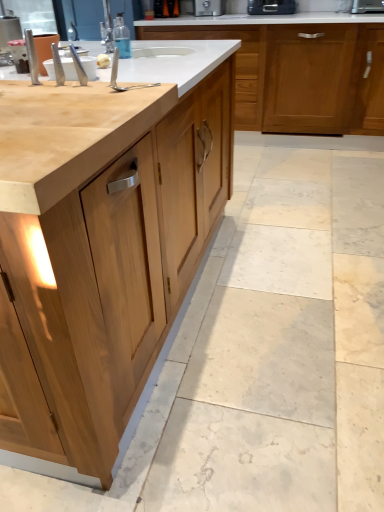
Locate an element on the screen. The image size is (384, 512). natural wood cabinet at center, which is the 1th cabinetry in front-to-back order is located at coordinates (119, 255).

Measure the distance between point (254, 18) and camera.

Point (254, 18) and camera are 2.88 meters apart.

Based on the photo, measure the distance between point (x=366, y=8) and camera.

Point (x=366, y=8) and camera are 9.47 feet apart.

Locate an element on the screen. natural wood cabinet at center, which is counted as the 2th cabinetry, starting from the back is located at coordinates (119, 255).

Could you measure the distance between matte wood cabinet at center, the 2th cabinetry in the front-to-back sequence, and natural wood cabinet at center, which is the 1th cabinetry in front-to-back order?

matte wood cabinet at center, the 2th cabinetry in the front-to-back sequence, and natural wood cabinet at center, which is the 1th cabinetry in front-to-back order, are 5.96 feet apart.

Considering the points (274, 122) and (1, 212), which point is behind, point (274, 122) or point (1, 212)?

Positioned behind is point (274, 122).

Based on the photo, between matte wood cabinet at center, the 2th cabinetry in the front-to-back sequence, and natural wood cabinet at center, which is the 1th cabinetry in front-to-back order, which one appears on the right side from the viewer's perspective?

matte wood cabinet at center, the 2th cabinetry in the front-to-back sequence.

Is matte wood cabinet at center, the first cabinetry positioned from the back, directly adjacent to natural wood cabinet at center, which is the 1th cabinetry in front-to-back order?

matte wood cabinet at center, the first cabinetry positioned from the back, is not next to natural wood cabinet at center, which is the 1th cabinetry in front-to-back order, and they're not touching.

Considering the sizes of objects metallic silver toaster at upper right, which is the second appliance in left-to-right order, and transparent plastic bottle at upper center in the image provided, who is smaller, metallic silver toaster at upper right, which is the second appliance in left-to-right order, or transparent plastic bottle at upper center?

Smaller between the two is transparent plastic bottle at upper center.

The width and height of the screenshot is (384, 512). What are the coordinates of `appliance that is the 1st object located behind the transparent plastic bottle at upper center` in the screenshot? It's located at (367, 6).

Do you think metallic silver toaster at upper right, which is the second appliance in left-to-right order, is within transparent plastic bottle at upper center, or outside of it?

The correct answer is: outside.

Is metallic silver toaster at upper right, which is the second appliance in left-to-right order, far away from transparent plastic bottle at upper center?

That's right, there is a large distance between metallic silver toaster at upper right, which is the second appliance in left-to-right order, and transparent plastic bottle at upper center.

Considering the positions of objects metallic silver toaster at upper right, the 1th appliance in the right-to-left sequence, and natural wood cabinet at center, which is the 1th cabinetry in front-to-back order, in the image provided, who is more to the right, metallic silver toaster at upper right, the 1th appliance in the right-to-left sequence, or natural wood cabinet at center, which is the 1th cabinetry in front-to-back order,?

Positioned to the right is metallic silver toaster at upper right, the 1th appliance in the right-to-left sequence.

Locate an element on the screen. Image resolution: width=384 pixels, height=512 pixels. the 1st appliance above when counting from the natural wood cabinet at center, which is the 1th cabinetry in front-to-back order (from the image's perspective) is located at coordinates 367,6.

Considering the relative sizes of metallic silver toaster at upper right, which is the second appliance in left-to-right order, and natural wood cabinet at center, which is the 1th cabinetry in front-to-back order, in the image provided, is metallic silver toaster at upper right, which is the second appliance in left-to-right order, taller than natural wood cabinet at center, which is the 1th cabinetry in front-to-back order,?

No.

Is metallic silver toaster at upper right, the 1th appliance in the right-to-left sequence, facing away from natural wood cabinet at center, which is the 1th cabinetry in front-to-back order?

That's not correct — metallic silver toaster at upper right, the 1th appliance in the right-to-left sequence, is not looking away from natural wood cabinet at center, which is the 1th cabinetry in front-to-back order.

Is metallic silver toaster at upper right, which is the second appliance in left-to-right order, touching matte wood cabinet at center, the 2th cabinetry in the front-to-back sequence?

Result: metallic silver toaster at upper right, which is the second appliance in left-to-right order, is not next to matte wood cabinet at center, the 2th cabinetry in the front-to-back sequence, and they're not touching.

Is metallic silver toaster at upper right, which is the second appliance in left-to-right order, wider or thinner than matte wood cabinet at center, the first cabinetry positioned from the back?

Considering their sizes, metallic silver toaster at upper right, which is the second appliance in left-to-right order, looks slimmer than matte wood cabinet at center, the first cabinetry positioned from the back.

Is metallic silver toaster at upper right, which is the second appliance in left-to-right order, bigger than matte wood cabinet at center, the first cabinetry positioned from the back?

Actually, metallic silver toaster at upper right, which is the second appliance in left-to-right order, might be smaller than matte wood cabinet at center, the first cabinetry positioned from the back.

Which object is further away from the camera taking this photo, metallic silver toaster at upper right, which is the second appliance in left-to-right order, or matte wood cabinet at center, the 2th cabinetry in the front-to-back sequence?

metallic silver toaster at upper right, which is the second appliance in left-to-right order, is behind.

Does black plastic toaster at upper center, which ranks as the 1th appliance in left-to-right order, come in front of matte wood cabinet at center, the 2th cabinetry in the front-to-back sequence?

No, black plastic toaster at upper center, which ranks as the 1th appliance in left-to-right order, is further to the viewer.

Is point (249, 14) positioned after point (329, 110)?

No, it is in front of (329, 110).

Considering the relative sizes of black plastic toaster at upper center, marked as the 2th appliance in a right-to-left arrangement, and matte wood cabinet at center, the first cabinetry positioned from the back, in the image provided, is black plastic toaster at upper center, marked as the 2th appliance in a right-to-left arrangement, thinner than matte wood cabinet at center, the first cabinetry positioned from the back,?

Correct, the width of black plastic toaster at upper center, marked as the 2th appliance in a right-to-left arrangement, is less than that of matte wood cabinet at center, the first cabinetry positioned from the back.

Who is smaller, black plastic toaster at upper center, marked as the 2th appliance in a right-to-left arrangement, or matte wood cabinet at center, the 2th cabinetry in the front-to-back sequence?

With smaller size is black plastic toaster at upper center, marked as the 2th appliance in a right-to-left arrangement.

Can you confirm if matte wood cabinet at center, the first cabinetry positioned from the back, is positioned to the right of black plastic toaster at upper center, marked as the 2th appliance in a right-to-left arrangement?

Correct, you'll find matte wood cabinet at center, the first cabinetry positioned from the back, to the right of black plastic toaster at upper center, marked as the 2th appliance in a right-to-left arrangement.

Is matte wood cabinet at center, the 2th cabinetry in the front-to-back sequence, situated inside black plastic toaster at upper center, which ranks as the 1th appliance in left-to-right order, or outside?

matte wood cabinet at center, the 2th cabinetry in the front-to-back sequence, is located beyond the bounds of black plastic toaster at upper center, which ranks as the 1th appliance in left-to-right order.

Is matte wood cabinet at center, the first cabinetry positioned from the back, wider than black plastic toaster at upper center, which ranks as the 1th appliance in left-to-right order?

Correct, the width of matte wood cabinet at center, the first cabinetry positioned from the back, exceeds that of black plastic toaster at upper center, which ranks as the 1th appliance in left-to-right order.

Considering the positions of objects matte wood cabinet at center, the 2th cabinetry in the front-to-back sequence, and black plastic toaster at upper center, which ranks as the 1th appliance in left-to-right order, in the image provided, who is behind, matte wood cabinet at center, the 2th cabinetry in the front-to-back sequence, or black plastic toaster at upper center, which ranks as the 1th appliance in left-to-right order,?

black plastic toaster at upper center, which ranks as the 1th appliance in left-to-right order, is more distant.

From the image's perspective, would you say black plastic toaster at upper center, which ranks as the 1th appliance in left-to-right order, is positioned over natural wood cabinet at center, which is counted as the 2th cabinetry, starting from the back?

Yes, from the image's perspective, black plastic toaster at upper center, which ranks as the 1th appliance in left-to-right order, is on top of natural wood cabinet at center, which is counted as the 2th cabinetry, starting from the back.

In the image, is black plastic toaster at upper center, which ranks as the 1th appliance in left-to-right order, positioned in front of or behind natural wood cabinet at center, which is counted as the 2th cabinetry, starting from the back?

Clearly, black plastic toaster at upper center, which ranks as the 1th appliance in left-to-right order, is behind natural wood cabinet at center, which is counted as the 2th cabinetry, starting from the back.

From a real-world perspective, relative to natural wood cabinet at center, which is the 1th cabinetry in front-to-back order, is black plastic toaster at upper center, marked as the 2th appliance in a right-to-left arrangement, vertically above or below?

From a real-world perspective, black plastic toaster at upper center, marked as the 2th appliance in a right-to-left arrangement, is physically above natural wood cabinet at center, which is the 1th cabinetry in front-to-back order.

What's the angular difference between black plastic toaster at upper center, which ranks as the 1th appliance in left-to-right order, and natural wood cabinet at center, which is the 1th cabinetry in front-to-back order,'s facing directions?

The angular difference between black plastic toaster at upper center, which ranks as the 1th appliance in left-to-right order, and natural wood cabinet at center, which is the 1th cabinetry in front-to-back order, is 87.2 degrees.

Locate an element on the screen. The height and width of the screenshot is (512, 384). cabinetry below the natural wood cabinet at center, which is the 1th cabinetry in front-to-back order (from a real-world perspective) is located at coordinates (296, 69).

At what (x,y) coordinates should I click in order to perform the action: click on bottle located in front of the metallic silver toaster at upper right, the 1th appliance in the right-to-left sequence. Please return your answer as a coordinate pair (x, y). The width and height of the screenshot is (384, 512). Looking at the image, I should click on (122, 37).

Based on their spatial positions, is natural wood cabinet at center, which is counted as the 2th cabinetry, starting from the back, or transparent plastic bottle at upper center further from metallic silver toaster at upper right, which is the second appliance in left-to-right order?

natural wood cabinet at center, which is counted as the 2th cabinetry, starting from the back, is further to metallic silver toaster at upper right, which is the second appliance in left-to-right order.

Which object lies nearer to the anchor point transparent plastic bottle at upper center, natural wood cabinet at center, which is counted as the 2th cabinetry, starting from the back, or metallic silver toaster at upper right, which is the second appliance in left-to-right order?

natural wood cabinet at center, which is counted as the 2th cabinetry, starting from the back, is positioned closer to the anchor transparent plastic bottle at upper center.

From the image, which object appears to be nearer to matte wood cabinet at center, the first cabinetry positioned from the back, transparent plastic bottle at upper center or natural wood cabinet at center, which is counted as the 2th cabinetry, starting from the back?

transparent plastic bottle at upper center is positioned closer to the anchor matte wood cabinet at center, the first cabinetry positioned from the back.

Which object lies nearer to the anchor point matte wood cabinet at center, the 2th cabinetry in the front-to-back sequence, metallic silver toaster at upper right, which is the second appliance in left-to-right order, or black plastic toaster at upper center, marked as the 2th appliance in a right-to-left arrangement?

The object closer to matte wood cabinet at center, the 2th cabinetry in the front-to-back sequence, is black plastic toaster at upper center, marked as the 2th appliance in a right-to-left arrangement.

Based on their spatial positions, is black plastic toaster at upper center, which ranks as the 1th appliance in left-to-right order, or metallic silver toaster at upper right, the 1th appliance in the right-to-left sequence, closer to transparent plastic bottle at upper center?

black plastic toaster at upper center, which ranks as the 1th appliance in left-to-right order, is closer to transparent plastic bottle at upper center.

Based on their spatial positions, is metallic silver toaster at upper right, which is the second appliance in left-to-right order, or matte wood cabinet at center, the first cabinetry positioned from the back, closer to black plastic toaster at upper center, marked as the 2th appliance in a right-to-left arrangement?

The object closer to black plastic toaster at upper center, marked as the 2th appliance in a right-to-left arrangement, is matte wood cabinet at center, the first cabinetry positioned from the back.

When comparing their distances from black plastic toaster at upper center, marked as the 2th appliance in a right-to-left arrangement, does natural wood cabinet at center, which is counted as the 2th cabinetry, starting from the back, or matte wood cabinet at center, the first cabinetry positioned from the back, seem closer?

matte wood cabinet at center, the first cabinetry positioned from the back, lies closer to black plastic toaster at upper center, marked as the 2th appliance in a right-to-left arrangement, than the other object.

Looking at this image, based on their spatial positions, is matte wood cabinet at center, the 2th cabinetry in the front-to-back sequence, or natural wood cabinet at center, which is the 1th cabinetry in front-to-back order, further from metallic silver toaster at upper right, which is the second appliance in left-to-right order?

natural wood cabinet at center, which is the 1th cabinetry in front-to-back order, lies further to metallic silver toaster at upper right, which is the second appliance in left-to-right order, than the other object.

Identify the location of bottle located between natural wood cabinet at center, which is counted as the 2th cabinetry, starting from the back, and matte wood cabinet at center, the first cabinetry positioned from the back, in the depth direction. (122, 37).

The height and width of the screenshot is (512, 384). Find the location of `cabinetry positioned between natural wood cabinet at center, which is counted as the 2th cabinetry, starting from the back, and metallic silver toaster at upper right, the 1th appliance in the right-to-left sequence, from near to far`. cabinetry positioned between natural wood cabinet at center, which is counted as the 2th cabinetry, starting from the back, and metallic silver toaster at upper right, the 1th appliance in the right-to-left sequence, from near to far is located at coordinates (296, 69).

Image resolution: width=384 pixels, height=512 pixels. I want to click on cabinetry between transparent plastic bottle at upper center and black plastic toaster at upper center, marked as the 2th appliance in a right-to-left arrangement, from front to back, so click(x=296, y=69).

The width and height of the screenshot is (384, 512). I want to click on cabinetry situated between transparent plastic bottle at upper center and metallic silver toaster at upper right, which is the second appliance in left-to-right order, from left to right, so click(296, 69).